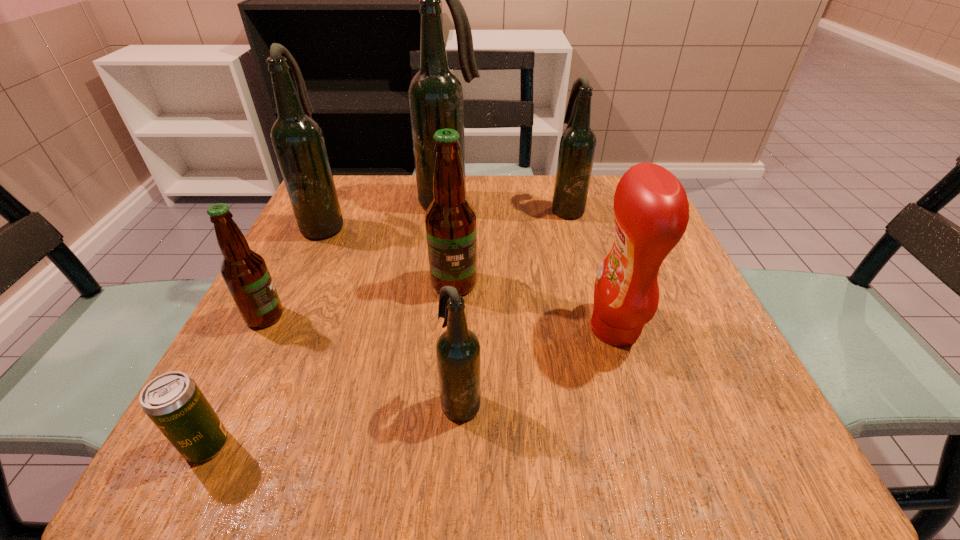
Identify the location of vacant space located 0.110m on the label side of the condiment. (524, 329).

Find the location of `vacant region located on the label side of the condiment`. vacant region located on the label side of the condiment is located at coordinates (430, 329).

I want to click on vacant space situated 0.400m on the label of the nearer brown beer bottle, so click(x=510, y=316).

Find the location of a particular element. The height and width of the screenshot is (540, 960). blank area located 0.060m on the right of the second nearest object is located at coordinates (521, 401).

The height and width of the screenshot is (540, 960). In order to click on blank area located on the back of the nearest object in this screenshot , I will do `click(266, 326)`.

In order to click on beer bottle that is at the near edge in this screenshot , I will do `click(458, 352)`.

This screenshot has width=960, height=540. Identify the location of beer can located at the near edge. (173, 401).

In order to click on beer can that is at the left edge in this screenshot , I will do `click(173, 401)`.

The height and width of the screenshot is (540, 960). I want to click on beer bottle located at the right edge, so click(x=577, y=147).

This screenshot has height=540, width=960. I want to click on condiment at the right edge, so click(x=651, y=210).